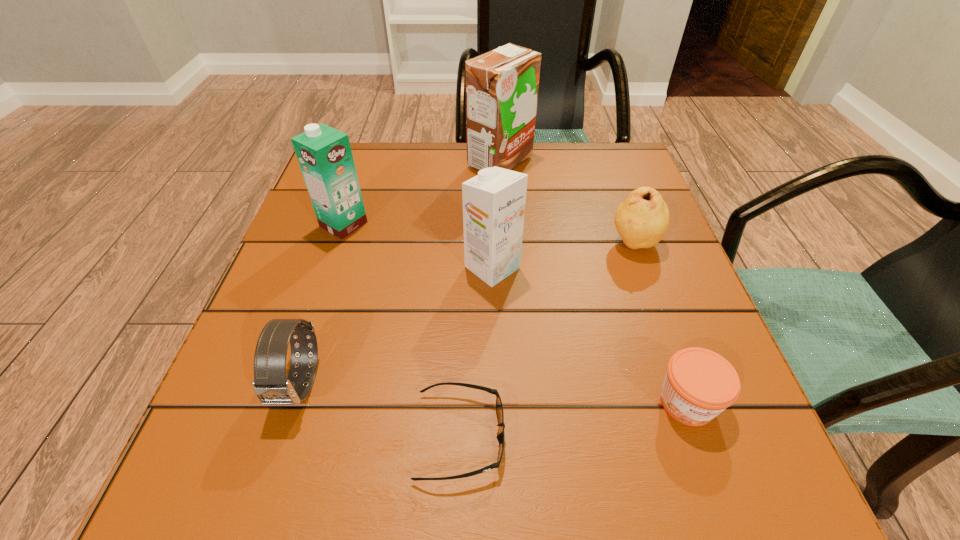
Find the location of `watch that is at the left edge`. watch that is at the left edge is located at coordinates (271, 386).

Find the location of a particular element. The height and width of the screenshot is (540, 960). pear that is at the right edge is located at coordinates (641, 220).

Locate an element on the screen. This screenshot has height=540, width=960. jam that is positioned at the right edge is located at coordinates (699, 384).

Where is `free space at the far edge`? free space at the far edge is located at coordinates (444, 180).

Locate an element on the screen. The height and width of the screenshot is (540, 960). vacant area at the left edge of the desktop is located at coordinates (222, 394).

The image size is (960, 540). Identify the location of blank area at the right edge. (645, 272).

I want to click on vacant space at the far left corner of the desktop, so pyautogui.click(x=383, y=159).

At what (x,y) coordinates should I click in order to perform the action: click on free region at the near left corner of the desktop. Please return your answer as a coordinate pair (x, y). The height and width of the screenshot is (540, 960). Looking at the image, I should click on (252, 509).

The image size is (960, 540). Identify the location of free region at the far right corner of the desktop. (589, 154).

Image resolution: width=960 pixels, height=540 pixels. I want to click on free space between the tallest object and the sunglasses, so coord(480,299).